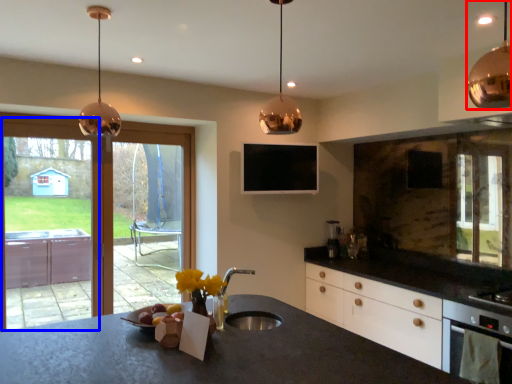
Question: Which point is closer to the camera, lamp (highlighted by a red box) or screen door (highlighted by a blue box)?

Choices:
 (A) lamp
 (B) screen door

Answer: (A)